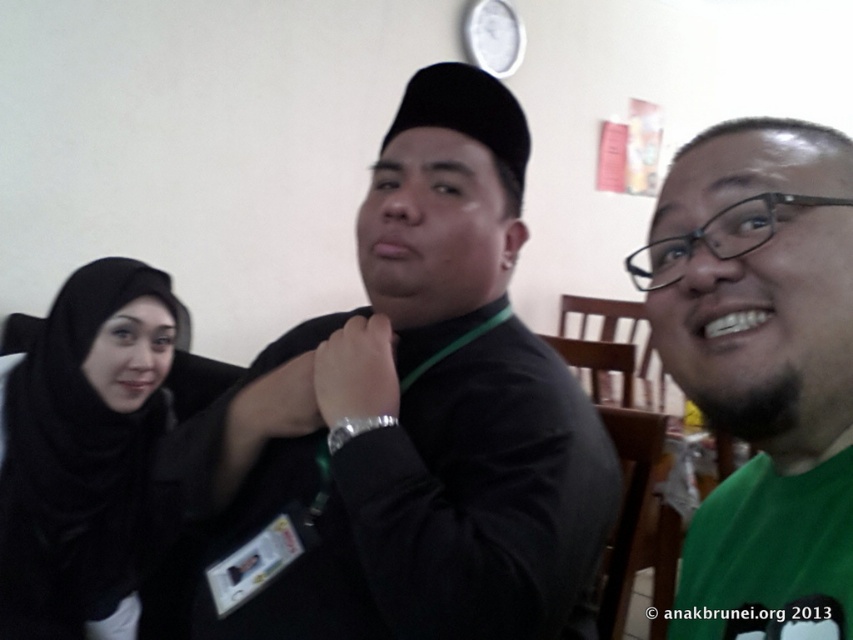
Question: From the image, what is the correct spatial relationship of black matte shirt at center in relation to green matte shirt at right?

Choices:
 (A) above
 (B) below

Answer: (B)

Question: Which object is closer to the camera taking this photo?

Choices:
 (A) black matte shirt at center
 (B) black matte hijab at left
 (C) green matte shirt at right

Answer: (C)

Question: Which point is farther to the camera?

Choices:
 (A) green matte shirt at right
 (B) black matte hijab at left
 (C) black matte shirt at center

Answer: (B)

Question: Does black matte shirt at center have a larger size compared to green matte shirt at right?

Choices:
 (A) yes
 (B) no

Answer: (A)

Question: Is black matte shirt at center bigger than black matte hijab at left?

Choices:
 (A) yes
 (B) no

Answer: (A)

Question: Estimate the real-world distances between objects in this image. Which object is closer to the green matte shirt at right?

Choices:
 (A) black matte shirt at center
 (B) black matte hijab at left

Answer: (A)